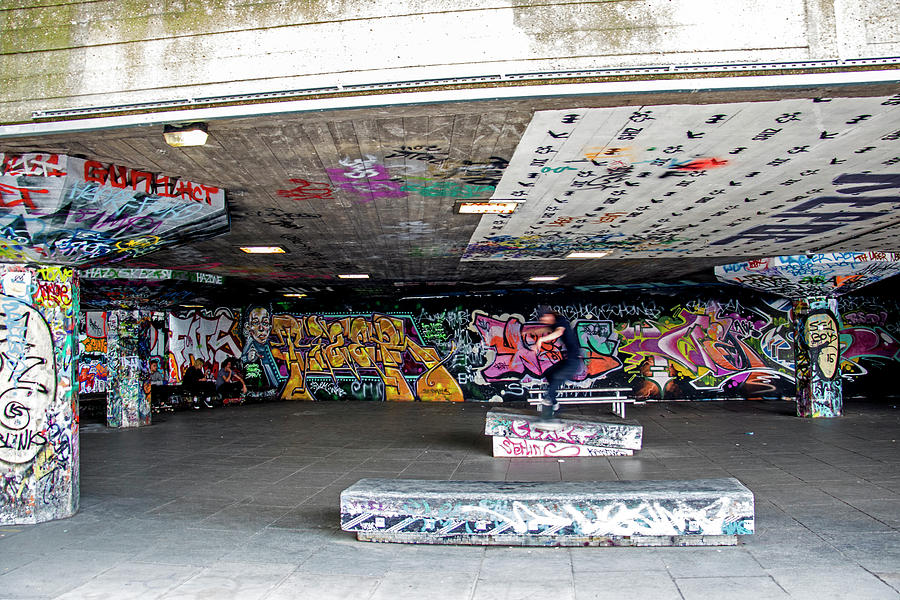
Image resolution: width=900 pixels, height=600 pixels. In order to click on green moss on top wall in this screenshot , I will do `click(131, 3)`, `click(32, 22)`, `click(256, 16)`, `click(586, 17)`.